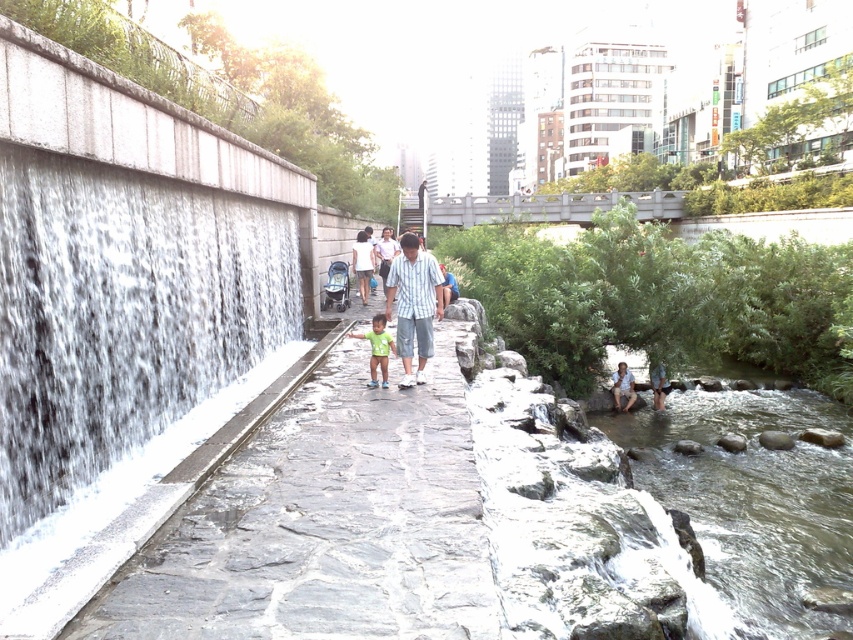
Question: Considering the relative positions of white textured waterfall at left and green matte shirt at center in the image provided, where is white textured waterfall at left located with respect to green matte shirt at center?

Choices:
 (A) above
 (B) below

Answer: (A)

Question: Does gray stone path at center appear on the right side of clear water at stream right?

Choices:
 (A) no
 (B) yes

Answer: (A)

Question: Among these objects, which one is farthest from the camera?

Choices:
 (A) white textured waterfall at left
 (B) green matte shirt at center
 (C) striped cotton shirt at center
 (D) gray stone path at center

Answer: (C)

Question: Which point is closer to the camera taking this photo?

Choices:
 (A) (56, 237)
 (B) (430, 320)
 (C) (331, 620)
 (D) (688, 465)

Answer: (C)

Question: Based on their relative distances, which object is nearer to the green matte shirt at center?

Choices:
 (A) gray stone path at center
 (B) white textured waterfall at left
 (C) striped cotton shirt at center

Answer: (C)

Question: Can you confirm if gray stone path at center is positioned above white textured waterfall at left?

Choices:
 (A) yes
 (B) no

Answer: (B)